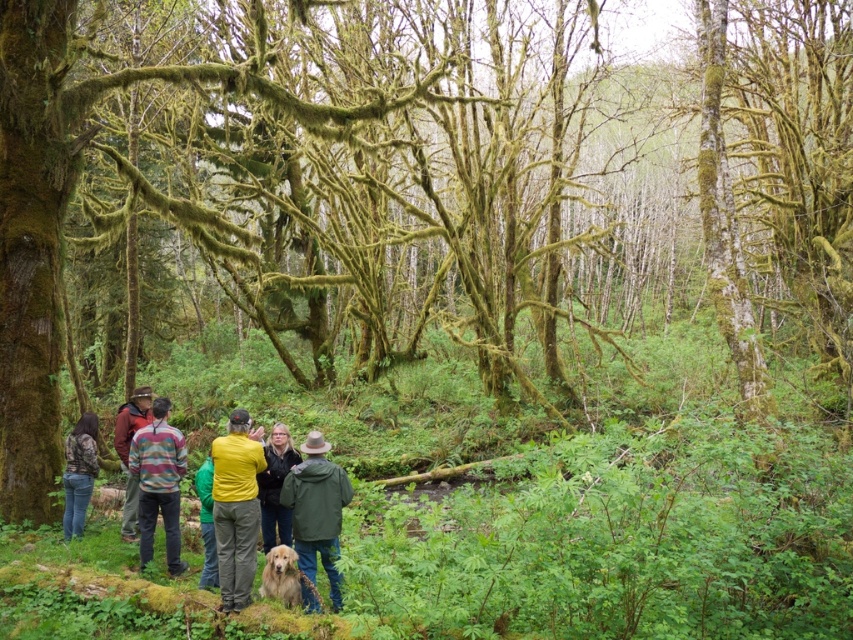
From the picture: Can you confirm if camouflage jacket at lower left is wider than green textured jacket at center?

Indeed, camouflage jacket at lower left has a greater width compared to green textured jacket at center.

Which is more to the left, camouflage jacket at lower left or green textured jacket at center?

Positioned to the left is camouflage jacket at lower left.

Who is more distant from viewer, (71,500) or (273,536)?

Point (71,500)

Image resolution: width=853 pixels, height=640 pixels. In order to click on camouflage jacket at lower left in this screenshot , I will do `click(79, 472)`.

Is point (165, 522) less distant than point (206, 584)?

No.

You are a GUI agent. You are given a task and a screenshot of the screen. Output one action in this format:
    pyautogui.click(x=<x>, y=<y>)
    Task: Click on the striped sweater at center
    The height and width of the screenshot is (640, 853).
    Given the screenshot: What is the action you would take?
    pyautogui.click(x=158, y=483)

Which is in front, point (142, 516) or point (198, 477)?

Point (198, 477) is more forward.

Locate an element on the screen. This screenshot has width=853, height=640. striped sweater at center is located at coordinates (158, 483).

Does point (279, 444) come farther from viewer compared to point (207, 554)?

Yes, it is.

From the picture: Between green textured jacket at center and green fuzzy sweater at center, which one has less height?

green fuzzy sweater at center is shorter.

Where is `green textured jacket at center`? green textured jacket at center is located at coordinates (276, 486).